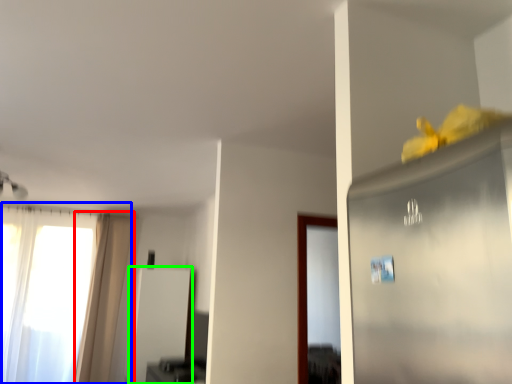
Question: Which object is the farthest from curtain (highlighted by a red box)? Choose among these: window (highlighted by a blue box) or screen door (highlighted by a green box).

Choices:
 (A) window
 (B) screen door

Answer: (B)